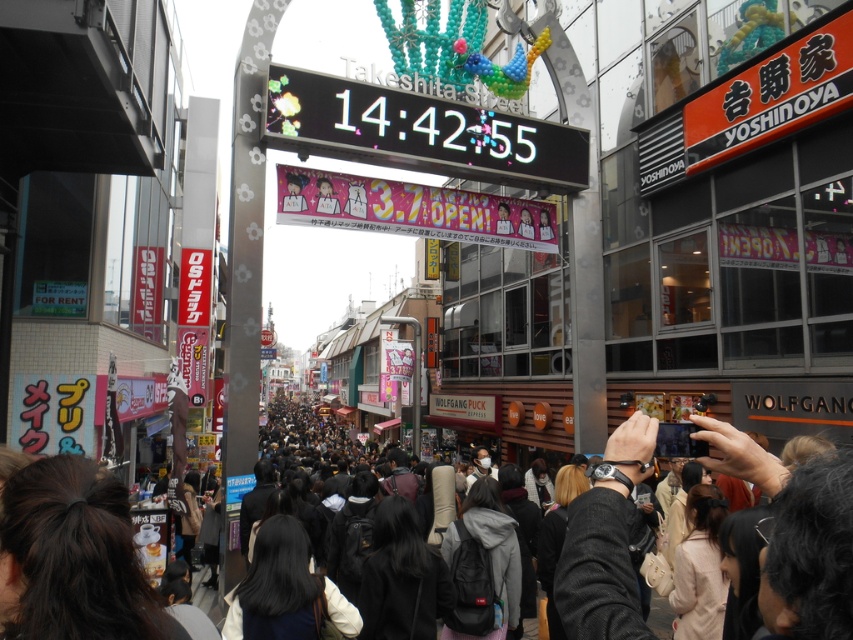
You are a photographer standing at the center of Takeshita Street, aiming to capture the crowd. If you want to focus on the dark brown hair at lower left, where should you point your camera relative to your current position?

The dark brown hair at lower left is located at coordinates 0.872 on the x axis and 0.086 on the y axis, so you should point your camera to the lower left direction from your current position to capture it.

Looking at this image, you are a photographer standing on Takeshita Street in Tokyo. You notice a pink glossy banner at center and a person with black hair at center. Which object is positioned higher in the scene?

The pink glossy banner at center is positioned higher than the black hair at center because it is above it.